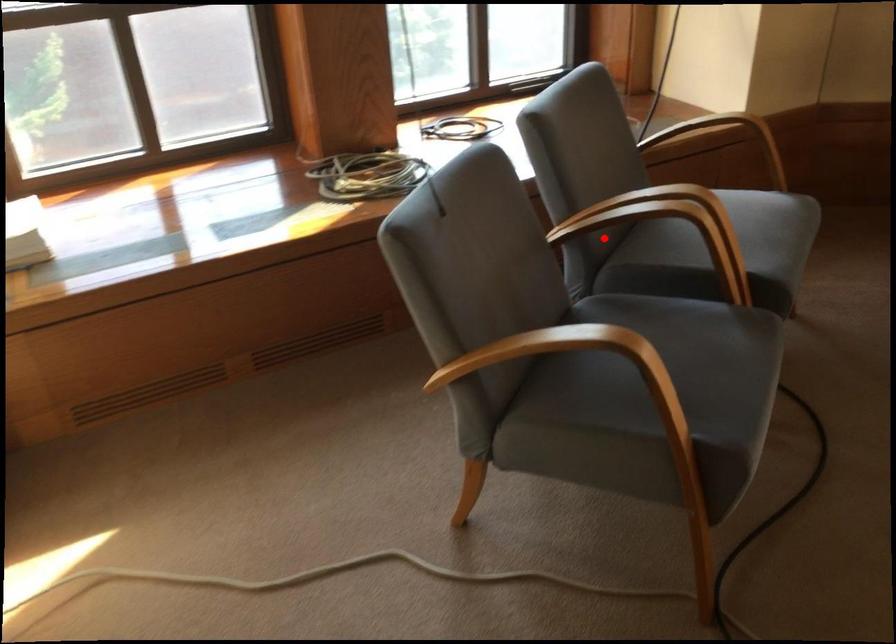
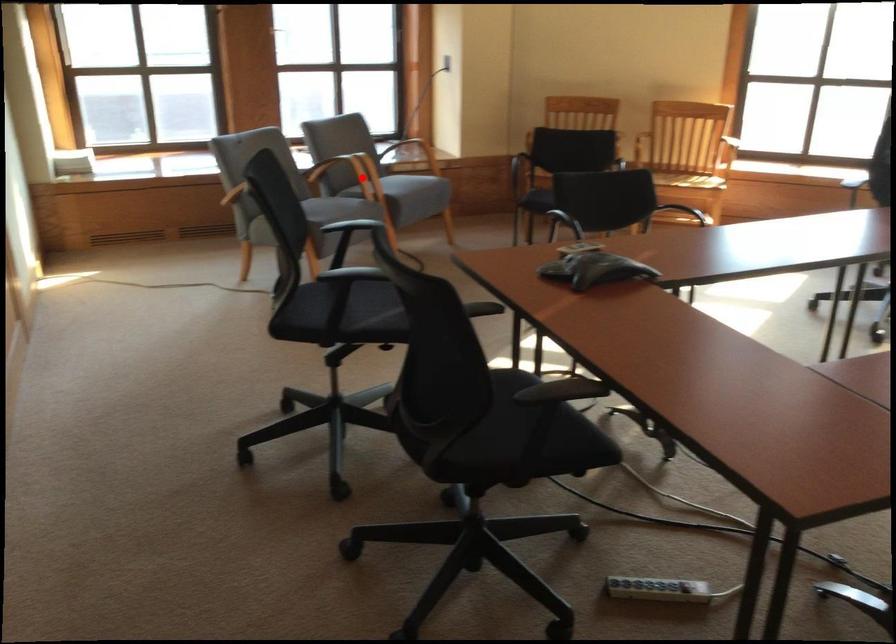
I am providing you with two images of the same scene from different viewpoints. A red point is marked on the first image and another point is marked on the second image. Does the point marked in image1 correspond to the same location as the one in image2?

No